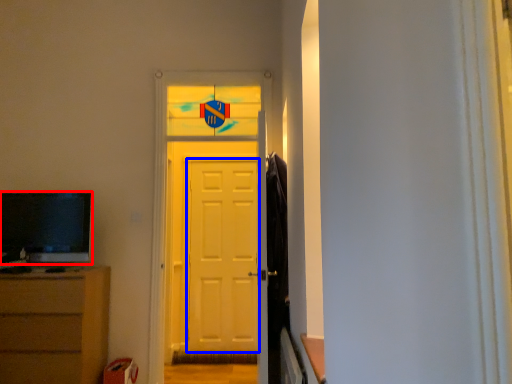
Question: Which point is further to the camera, television (highlighted by a red box) or screen door (highlighted by a blue box)?

Choices:
 (A) television
 (B) screen door

Answer: (B)